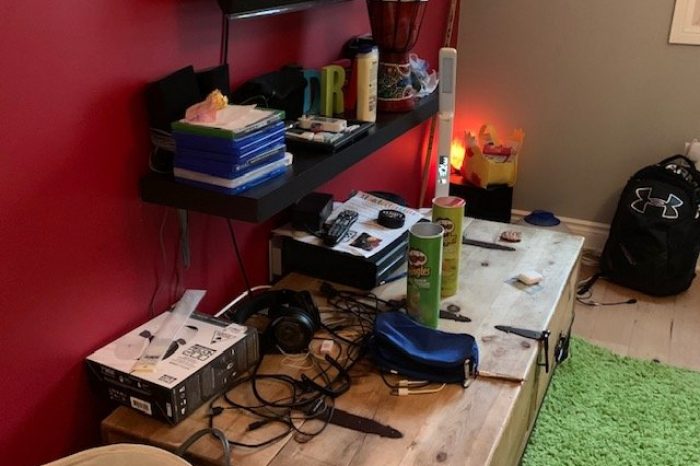
Image resolution: width=700 pixels, height=466 pixels. I want to click on grey wall, so click(x=536, y=83).